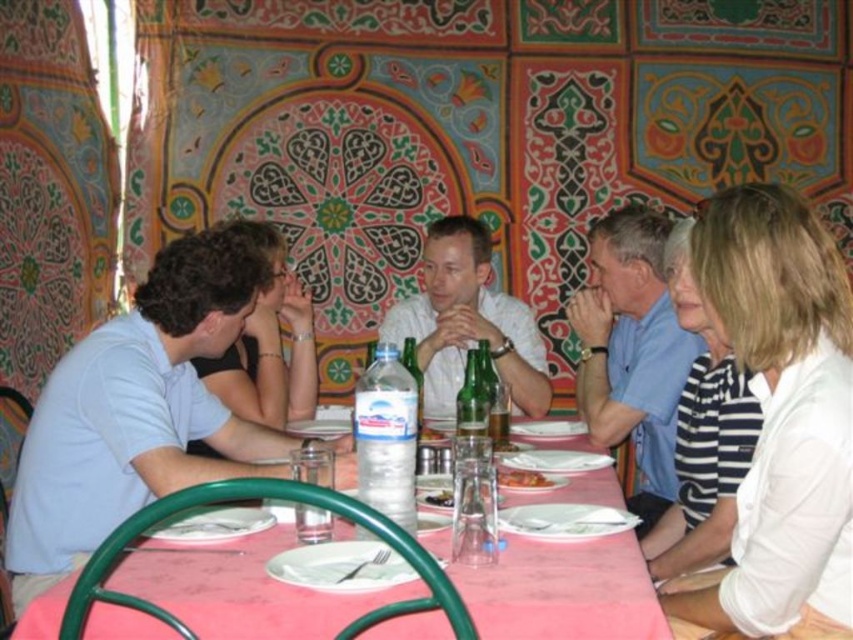
You are a waiter in a busy restaurant and need to place a new order of drinks on the table. The drinks are in a tray that is the same size as the clear glass water at table center. Can you fit the tray on the pink fabric table at center without overlapping any existing items?

The pink fabric table at center is larger in size than the clear glass water at table center. Since the tray is the same size as the clear glass water, there should be enough space on the pink fabric table at center to place the tray without overlapping existing items.

You are a photographer trying to capture a group photo of the people at the table. You want to ensure that the blue cotton shirt at upper right and the white matte shirt at center are both clearly visible in the photo. Based on their positions, which shirt should you focus on first to make sure it isn t cropped out of the frame?

The blue cotton shirt at upper right is in front of the white matte shirt at center, so you should focus on the blue cotton shirt at upper right first to ensure it isn t cropped out of the frame.

You are a photographer trying to capture a group photo of the people at the table. You notice the blue cotton shirt at upper right and the white matte shirt at center. Which shirt should you adjust in the frame to ensure both shirts are equally visible, considering their sizes?

The blue cotton shirt at upper right has a lesser width compared to white matte shirt at center. To ensure both shirts are equally visible, you should move the blue cotton shirt at upper right slightly forward or closer to the camera so that its smaller size is compensated in the frame.